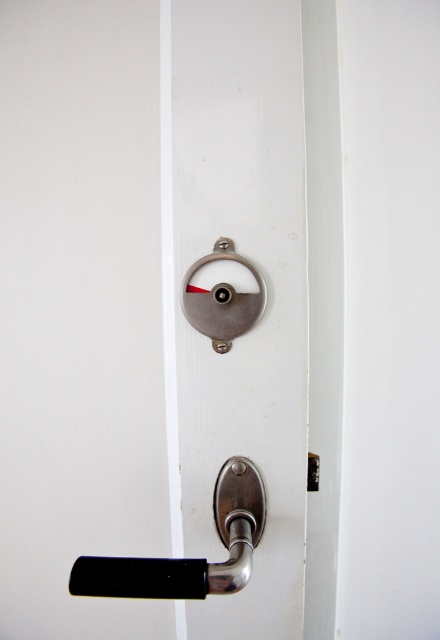
Is point (282, 416) closer to camera compared to point (252, 264)?

No, it is not.

Who is higher up, metallic silver lock at center or satin silver lock at center?

satin silver lock at center

Locate an element on the screen. This screenshot has width=440, height=640. metallic silver lock at center is located at coordinates (146, 301).

Who is shorter, black matte door handle at lower center or satin silver lock at center?

satin silver lock at center is shorter.

Is point (195, 584) in front of point (187, 285)?

Yes, it is in front of point (187, 285).

Where is `black matte door handle at lower center`? black matte door handle at lower center is located at coordinates (189, 557).

Is metallic silver lock at center thinner than black matte door handle at lower center?

In fact, metallic silver lock at center might be wider than black matte door handle at lower center.

Is point (65, 304) closer to camera compared to point (212, 566)?

No.

In order to click on metallic silver lock at center in this screenshot , I will do `click(146, 301)`.